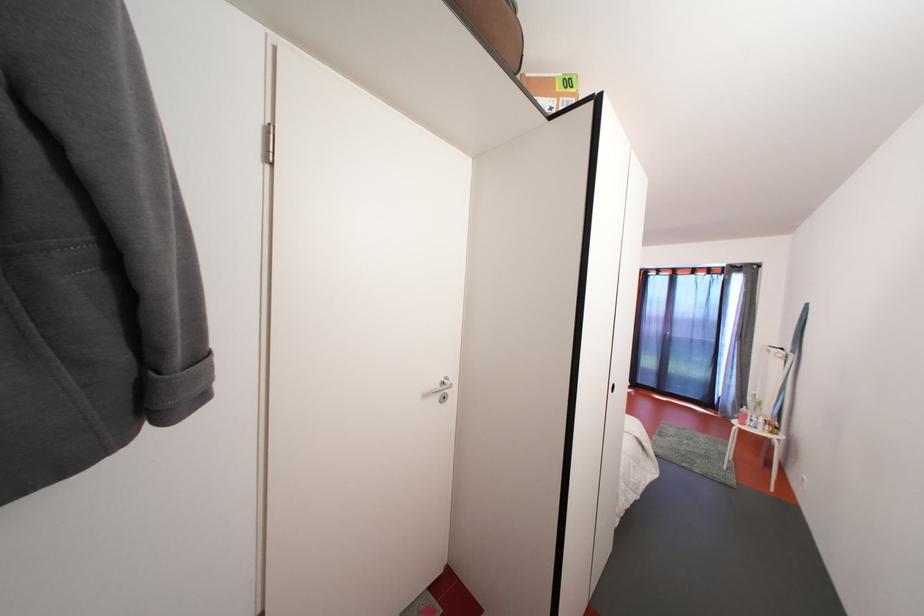
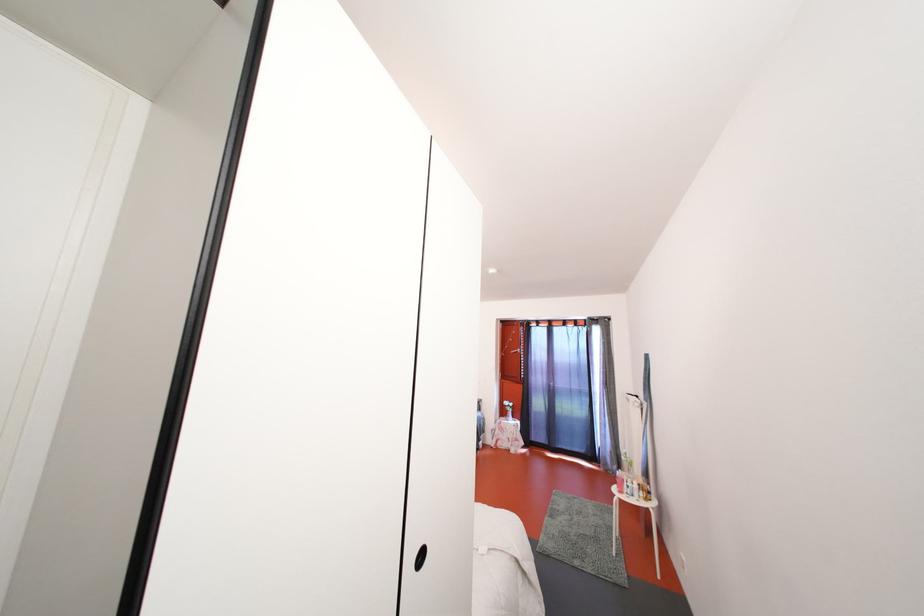
Question: Based on the continuous images, in which direction is the camera rotating? Reply with the corresponding letter.

Choices:
 (A) Left
 (B) Right
 (C) Up
 (D) Down

Answer: (B)